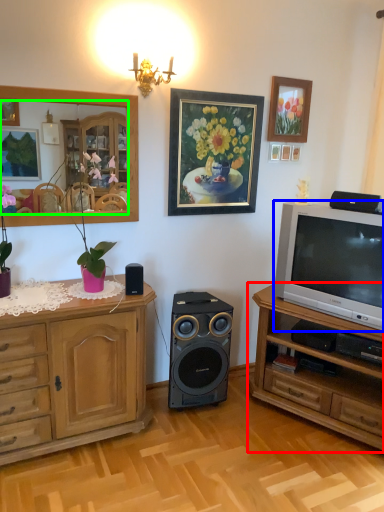
Question: Which object is positioned closest to chest of drawers (highlighted by a red box)? Select from television (highlighted by a blue box) and mirror (highlighted by a green box).

Choices:
 (A) television
 (B) mirror

Answer: (A)